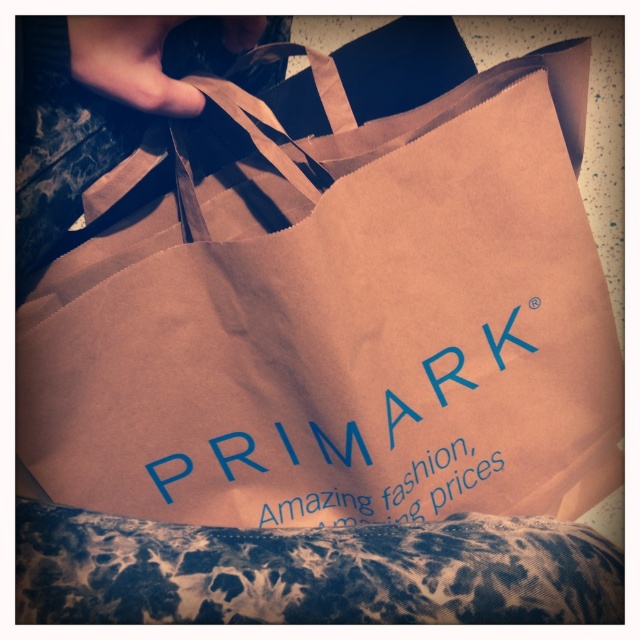
Is point (356, 349) farther from viewer compared to point (368, 500)?

No, (356, 349) is in front of (368, 500).

Measure the distance from brown paper bag at center to blue paper bag at center.

A distance of 8.00 centimeters exists between brown paper bag at center and blue paper bag at center.

Does point (296, 324) lie behind point (259, 524)?

No, (296, 324) is in front of (259, 524).

I want to click on brown paper bag at center, so click(x=340, y=323).

Looking at this image, which is below, brown paper bag at center or leopard print fabric pillow at lower center?

leopard print fabric pillow at lower center is below.

Does brown paper bag at center appear under leopard print fabric pillow at lower center?

Incorrect, brown paper bag at center is not positioned below leopard print fabric pillow at lower center.

Identify the location of brown paper bag at center. This screenshot has width=640, height=640. (340, 323).

What do you see at coordinates (310, 572) in the screenshot? This screenshot has height=640, width=640. I see `leopard print fabric pillow at lower center` at bounding box center [310, 572].

Does leopard print fabric pillow at lower center have a smaller size compared to blue paper bag at center?

Incorrect, leopard print fabric pillow at lower center is not smaller in size than blue paper bag at center.

The width and height of the screenshot is (640, 640). I want to click on leopard print fabric pillow at lower center, so click(x=310, y=572).